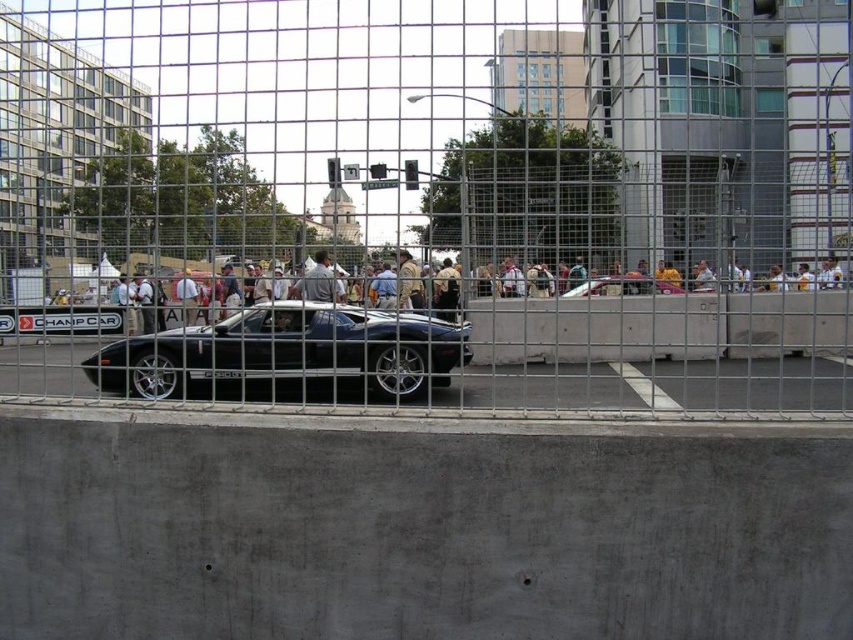
Question: Can you confirm if concrete at center is positioned to the right of shiny silver sports car at center?

Choices:
 (A) no
 (B) yes

Answer: (B)

Question: Where is shiny black sports car at center located in relation to concrete at center in the image?

Choices:
 (A) above
 (B) below

Answer: (B)

Question: Which point appears closest to the camera in this image?

Choices:
 (A) (567, 304)
 (B) (393, 368)

Answer: (B)

Question: Which of these objects is positioned closest to the concrete at center?

Choices:
 (A) shiny black sports car at center
 (B) concrete at lower center
 (C) light gray fabric jacket at center

Answer: (A)

Question: Can you confirm if concrete at lower center is positioned to the left of concrete at center?

Choices:
 (A) no
 (B) yes

Answer: (B)

Question: Which point is farther to the camera?

Choices:
 (A) (648, 289)
 (B) (387, 426)
 (C) (704, 150)
 (D) (167, 381)

Answer: (C)